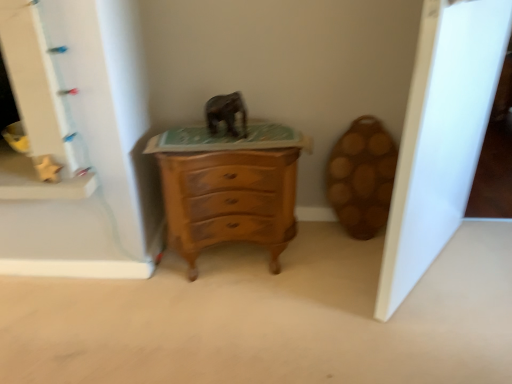
You are a GUI agent. You are given a task and a screenshot of the screen. Output one action in this format:
    pyautogui.click(x=<x>, y=<y>)
    Task: Click on the vacant area that is situated to the right of white glossy door at right
    The height and width of the screenshot is (384, 512).
    Given the screenshot: What is the action you would take?
    pyautogui.click(x=482, y=259)